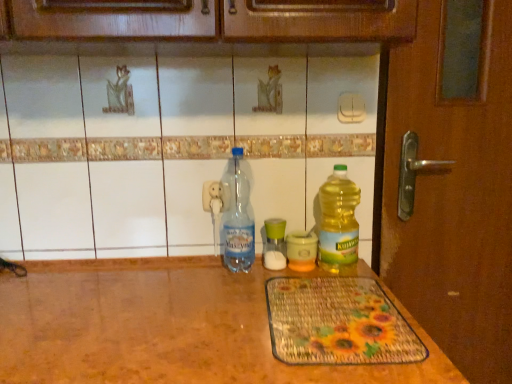
Question: Could you tell me if translucent plastic bottle at right, marked as the first bottle in a right-to-left arrangement, is turned towards yellow translucent bottle at center, which ranks as the 3th bottle in left-to-right order?

Choices:
 (A) no
 (B) yes

Answer: (A)

Question: Is translucent plastic bottle at right, which appears as the fourth bottle when viewed from the left, further to camera compared to yellow translucent bottle at center, which ranks as the 3th bottle in left-to-right order?

Choices:
 (A) yes
 (B) no

Answer: (B)

Question: Can you confirm if translucent plastic bottle at right, marked as the first bottle in a right-to-left arrangement, is positioned to the left of yellow translucent bottle at center, which ranks as the 3th bottle in left-to-right order?

Choices:
 (A) yes
 (B) no

Answer: (B)

Question: Is translucent plastic bottle at right, which appears as the fourth bottle when viewed from the left, bigger than yellow translucent bottle at center, the second bottle positioned from the right?

Choices:
 (A) yes
 (B) no

Answer: (A)

Question: Considering the relative sizes of translucent plastic bottle at right, marked as the first bottle in a right-to-left arrangement, and yellow translucent bottle at center, the second bottle positioned from the right, in the image provided, is translucent plastic bottle at right, marked as the first bottle in a right-to-left arrangement, smaller than yellow translucent bottle at center, the second bottle positioned from the right,?

Choices:
 (A) yes
 (B) no

Answer: (B)

Question: Is green glass jar at center, arranged as the 2th bottle when viewed from the left, in front of or behind translucent plastic bottle at right, marked as the first bottle in a right-to-left arrangement, in the image?

Choices:
 (A) behind
 (B) front

Answer: (A)

Question: Choose the correct answer: Is green glass jar at center, arranged as the 2th bottle when viewed from the left, inside translucent plastic bottle at right, which appears as the fourth bottle when viewed from the left, or outside it?

Choices:
 (A) outside
 (B) inside

Answer: (A)

Question: From a real-world perspective, is green glass jar at center, arranged as the 2th bottle when viewed from the left, physically located above or below translucent plastic bottle at right, which appears as the fourth bottle when viewed from the left?

Choices:
 (A) below
 (B) above

Answer: (A)

Question: Is point (266, 233) closer or farther from the camera than point (352, 201)?

Choices:
 (A) closer
 (B) farther

Answer: (A)

Question: Would you say transparent plastic bottle at center, which appears as the 1th bottle when viewed from the left, is to the left or to the right of translucent plastic bottle at right, which appears as the fourth bottle when viewed from the left, in the picture?

Choices:
 (A) right
 (B) left

Answer: (B)

Question: Is transparent plastic bottle at center, which appears as the 1th bottle when viewed from the left, taller or shorter than translucent plastic bottle at right, which appears as the fourth bottle when viewed from the left?

Choices:
 (A) short
 (B) tall

Answer: (B)

Question: Does point (231, 228) appear closer or farther from the camera than point (337, 243)?

Choices:
 (A) closer
 (B) farther

Answer: (B)

Question: From a real-world perspective, is transparent plastic bottle at center, which appears as the fourth bottle when viewed from the right, above or below translucent plastic bottle at right, marked as the first bottle in a right-to-left arrangement?

Choices:
 (A) below
 (B) above

Answer: (B)

Question: From the image's perspective, relative to transparent plastic bottle at center, which appears as the fourth bottle when viewed from the right, is green glass jar at center, arranged as the 2th bottle when viewed from the left, above or below?

Choices:
 (A) below
 (B) above

Answer: (A)

Question: Is point (266, 266) positioned closer to the camera than point (243, 213)?

Choices:
 (A) closer
 (B) farther

Answer: (A)